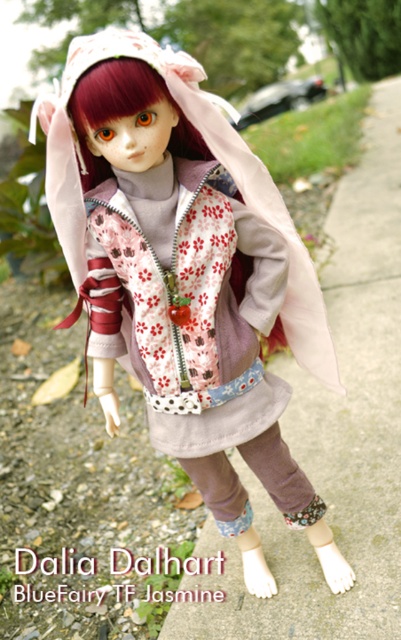
Question: Which of the following is the farthest from the observer?

Choices:
 (A) matte pink fabric at center
 (B) gray concrete pavement at center

Answer: (B)

Question: Does matte pink fabric at center have a larger size compared to gray concrete pavement at center?

Choices:
 (A) no
 (B) yes

Answer: (A)

Question: Which of the following is the farthest from the observer?

Choices:
 (A) (240, 260)
 (B) (358, 211)

Answer: (B)

Question: Where is matte pink fabric at center located in relation to gray concrete pavement at center in the image?

Choices:
 (A) below
 (B) above

Answer: (A)

Question: Can you confirm if matte pink fabric at center is positioned to the right of gray concrete pavement at center?

Choices:
 (A) yes
 (B) no

Answer: (B)